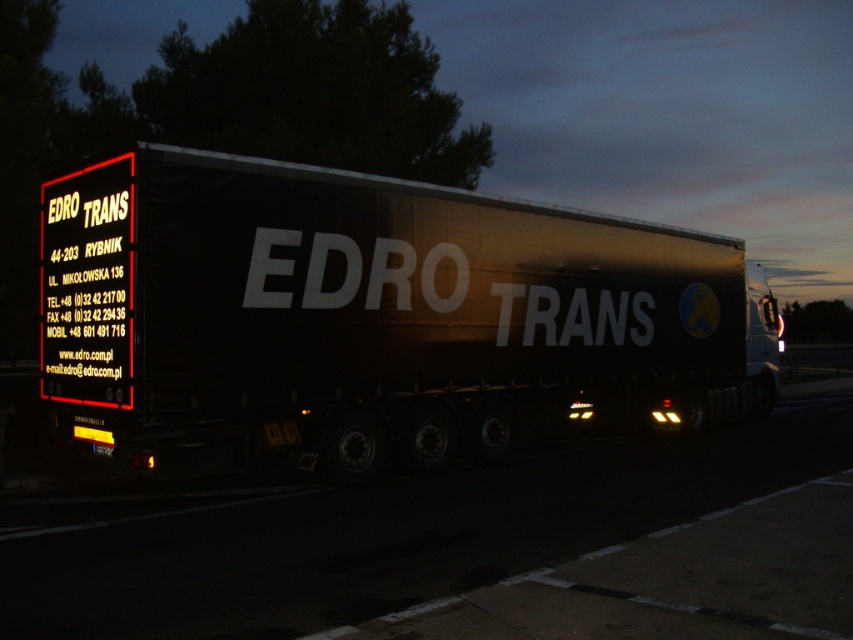
You are a delivery driver who needs to confirm the exact location of the EDRO TRANS trailer. Using the coordinate system where the bottom left corner of the image is the origin, can you determine if the point at coordinate point (x=370, y=316) is located on the metallic silver trailer at center?

Yes, the point at coordinate point (x=370, y=316) is located on the metallic silver trailer at center as stated in the description.